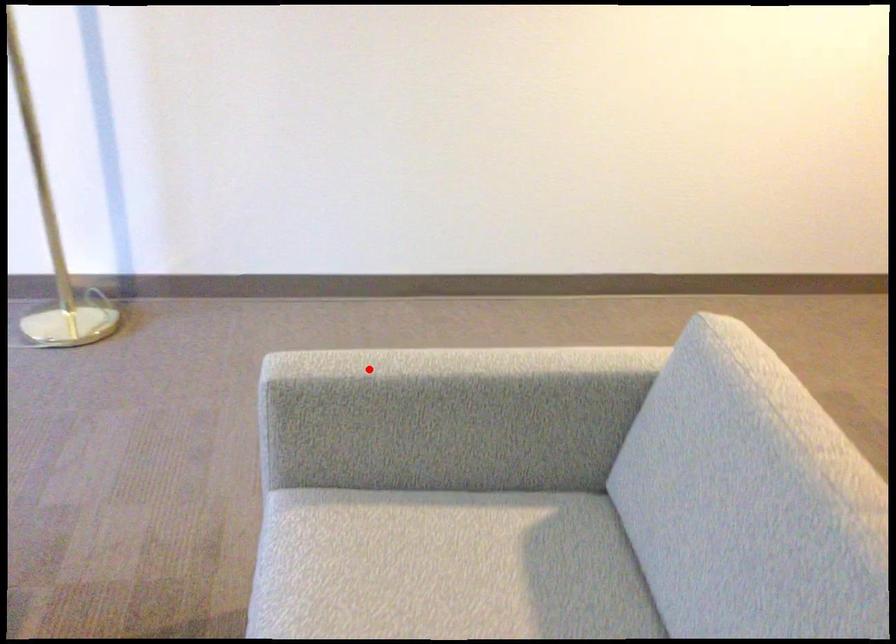
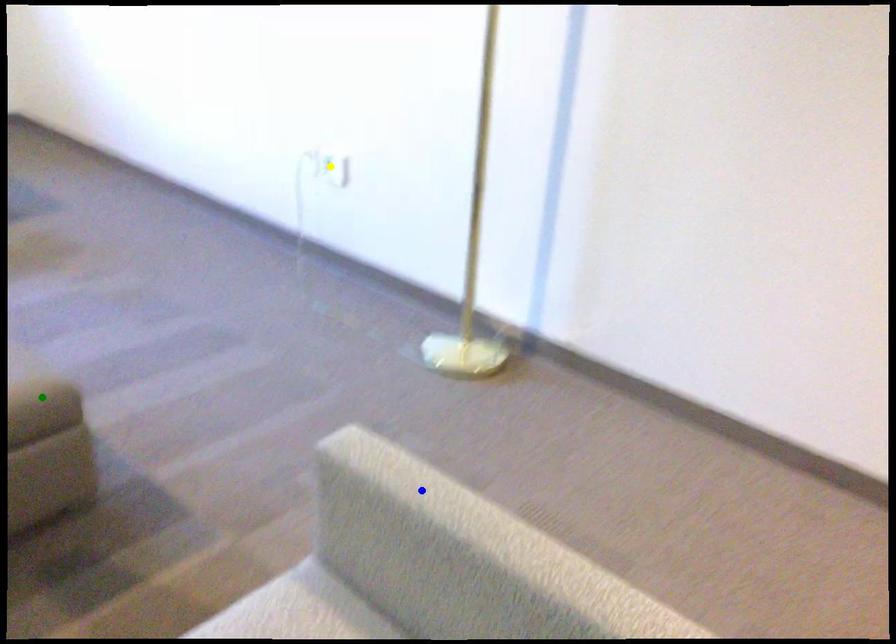
Question: I am providing you with two images of the same scene from different viewpoints. A red point is marked on the first image. You are given multiple points on the second image. Which point in image 2 is actually the same real-world point as the red point in image 1?

Choices:
 (A) green point
 (B) yellow point
 (C) blue point

Answer: (C)